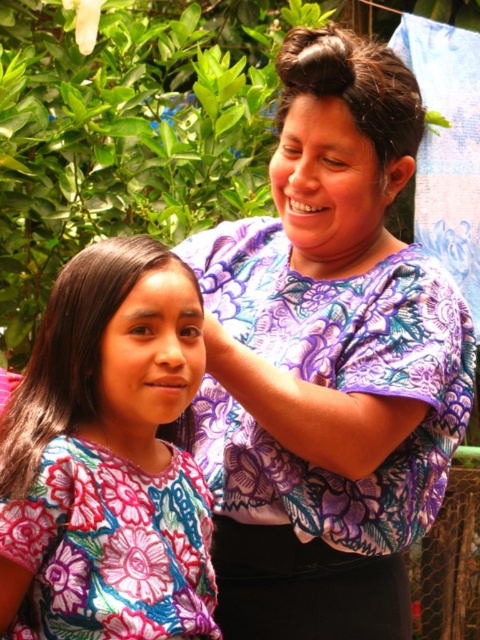
You are a fashion designer observing the image. You need to decide which item has a greater width between the floral fabric dress at left and the dark brown silky hair at upper center. Which one is wider?

The floral fabric dress at left has a greater width than the dark brown silky hair at upper center.

You are taking a photo of two people in a garden. The woman is wearing a purple floral blouse, and the girl is wearing a red floral blouse. There are two points marked in the image. One is at point (83, 422) and the other is at point (386, 147). Which point is closer to the camera?

Point (83, 422) is closer to the camera than point (386, 147).